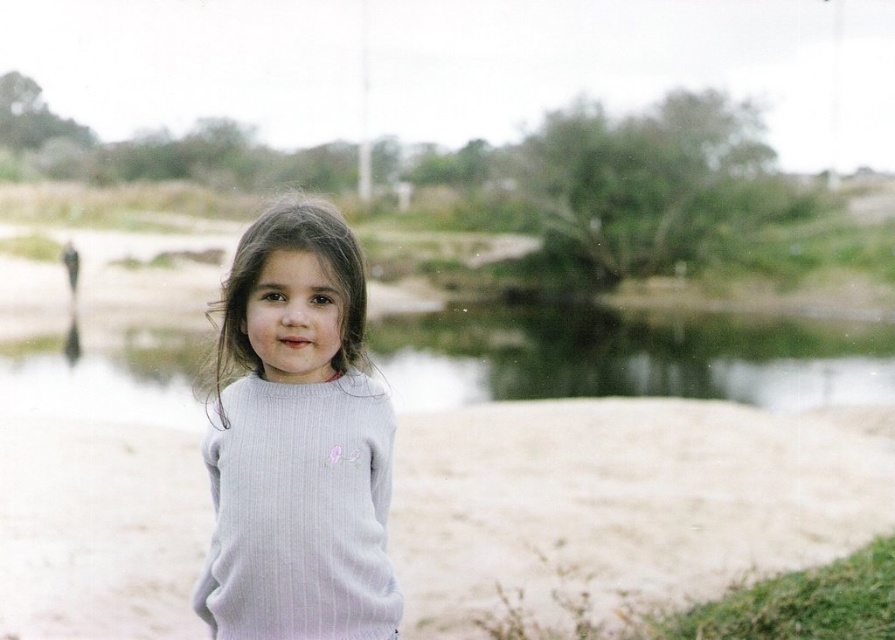
Question: Is white sand at center above green water at center?

Choices:
 (A) no
 (B) yes

Answer: (A)

Question: Does white sand at center appear under green water at center?

Choices:
 (A) no
 (B) yes

Answer: (B)

Question: Does white sand at center appear under green water at center?

Choices:
 (A) yes
 (B) no

Answer: (A)

Question: Which of the following is the farthest from the observer?

Choices:
 (A) (291, 625)
 (B) (550, 397)
 (C) (637, 484)

Answer: (B)

Question: Which object appears closest to the camera in this image?

Choices:
 (A) green water at center
 (B) white sand at center
 (C) light gray ribbed sweater at center

Answer: (C)

Question: Among these points, which one is farthest from the camera?

Choices:
 (A) (506, 349)
 (B) (529, 556)
 (C) (331, 294)

Answer: (A)